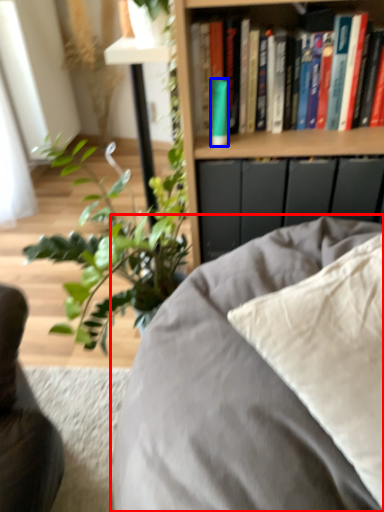
Question: Which point is closer to the camera, furniture (highlighted by a red box) or paperback book (highlighted by a blue box)?

Choices:
 (A) furniture
 (B) paperback book

Answer: (A)